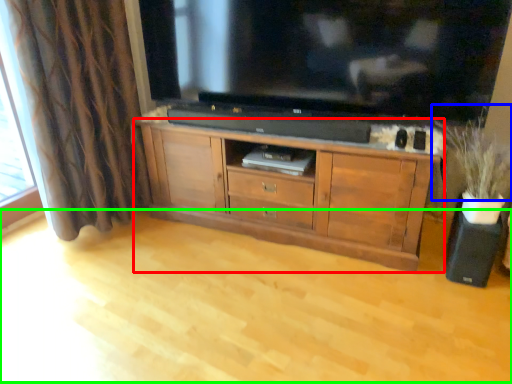
Question: Based on their relative distances, which object is nearer to cabinetry (highlighted by a red box)? Choose from plant (highlighted by a blue box) and plain (highlighted by a green box).

Choices:
 (A) plant
 (B) plain

Answer: (B)